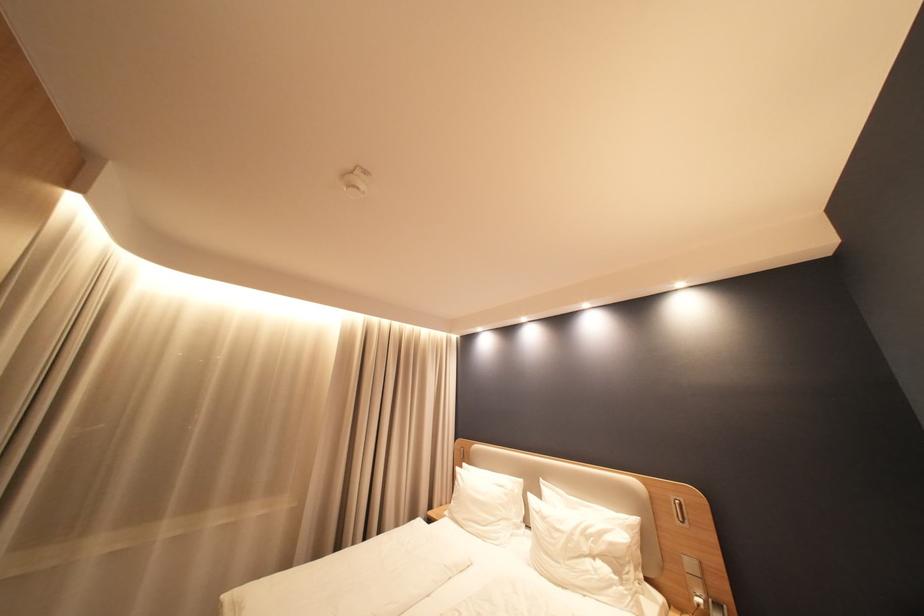
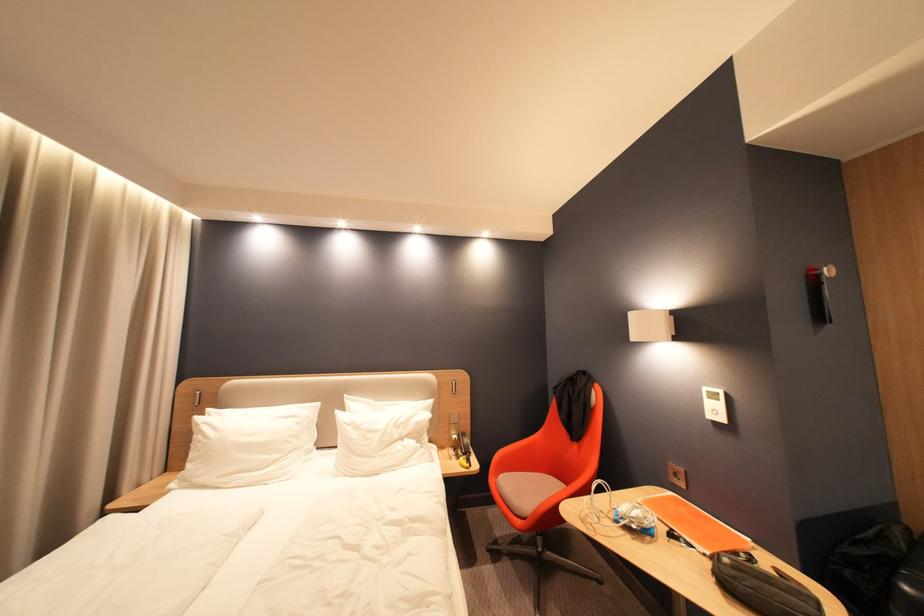
Locate, in the second image, the point that corresponds to the point at 649,519 in the first image.

(443, 400)